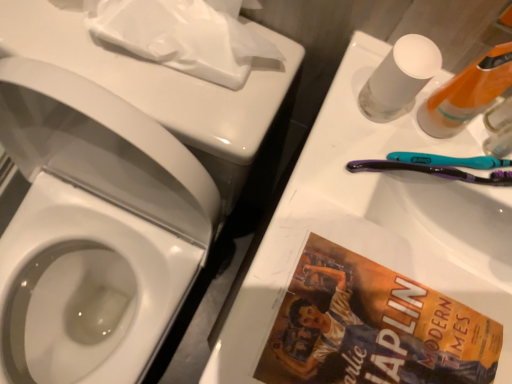
Question: Is purple plastic toothbrush at right wider than translucent plastic bottle at upper right, placed as the second mouthwash when sorted from left to right?

Choices:
 (A) no
 (B) yes

Answer: (B)

Question: Can you confirm if purple plastic toothbrush at right is bigger than translucent plastic bottle at upper right, the 1th mouthwash when ordered from right to left?

Choices:
 (A) no
 (B) yes

Answer: (B)

Question: Does purple plastic toothbrush at right appear on the left side of translucent plastic bottle at upper right, the 1th mouthwash when ordered from right to left?

Choices:
 (A) yes
 (B) no

Answer: (A)

Question: Is purple plastic toothbrush at right closer to the viewer compared to translucent plastic bottle at upper right, placed as the second mouthwash when sorted from left to right?

Choices:
 (A) yes
 (B) no

Answer: (B)

Question: From a real-world perspective, is purple plastic toothbrush at right positioned under translucent plastic bottle at upper right, the 1th mouthwash when ordered from right to left, based on gravity?

Choices:
 (A) no
 (B) yes

Answer: (B)

Question: Is purple plastic toothbrush at right positioned far away from translucent plastic bottle at upper right, the 1th mouthwash when ordered from right to left?

Choices:
 (A) yes
 (B) no

Answer: (B)

Question: Considering the relative positions of transparent plastic mouthwash at upper right, marked as the 1th mouthwash in a left-to-right arrangement, and white matte toilet paper at upper left in the image provided, is transparent plastic mouthwash at upper right, marked as the 1th mouthwash in a left-to-right arrangement, to the right of white matte toilet paper at upper left from the viewer's perspective?

Choices:
 (A) no
 (B) yes

Answer: (B)

Question: Is the depth of transparent plastic mouthwash at upper right, which is the second mouthwash in right-to-left order, greater than that of white matte toilet paper at upper left?

Choices:
 (A) no
 (B) yes

Answer: (A)

Question: Considering the relative sizes of transparent plastic mouthwash at upper right, which is the second mouthwash in right-to-left order, and white matte toilet paper at upper left in the image provided, is transparent plastic mouthwash at upper right, which is the second mouthwash in right-to-left order, bigger than white matte toilet paper at upper left?

Choices:
 (A) yes
 (B) no

Answer: (B)

Question: Is the position of transparent plastic mouthwash at upper right, which is the second mouthwash in right-to-left order, less distant than that of white matte toilet paper at upper left?

Choices:
 (A) yes
 (B) no

Answer: (A)

Question: Is transparent plastic mouthwash at upper right, marked as the 1th mouthwash in a left-to-right arrangement, outside of white matte toilet paper at upper left?

Choices:
 (A) yes
 (B) no

Answer: (A)

Question: Is transparent plastic mouthwash at upper right, which is the second mouthwash in right-to-left order, smaller than white matte toilet paper at upper left?

Choices:
 (A) yes
 (B) no

Answer: (A)

Question: Considering the relative sizes of translucent plastic bottle at upper right, placed as the second mouthwash when sorted from left to right, and purple plastic toothbrush at right in the image provided, is translucent plastic bottle at upper right, placed as the second mouthwash when sorted from left to right, wider than purple plastic toothbrush at right?

Choices:
 (A) no
 (B) yes

Answer: (A)